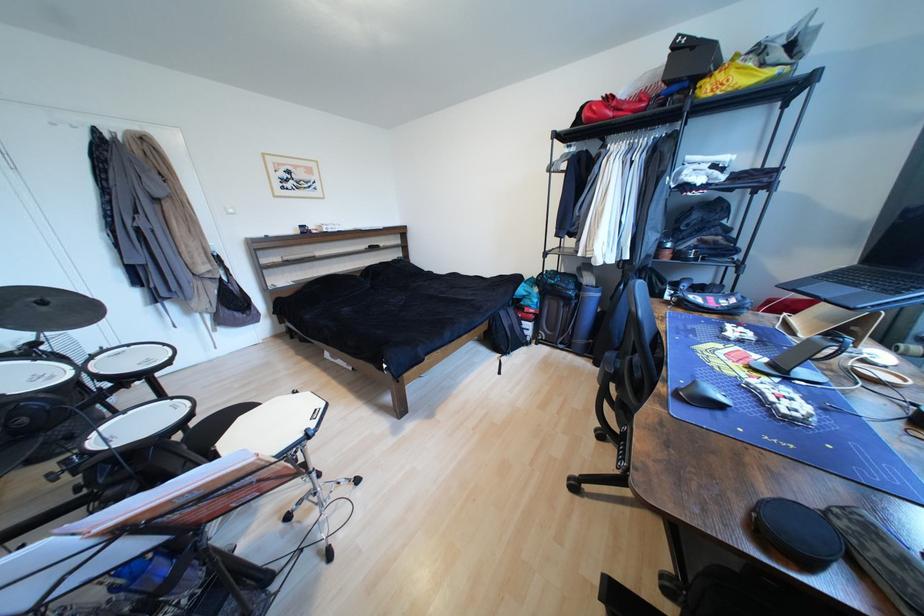
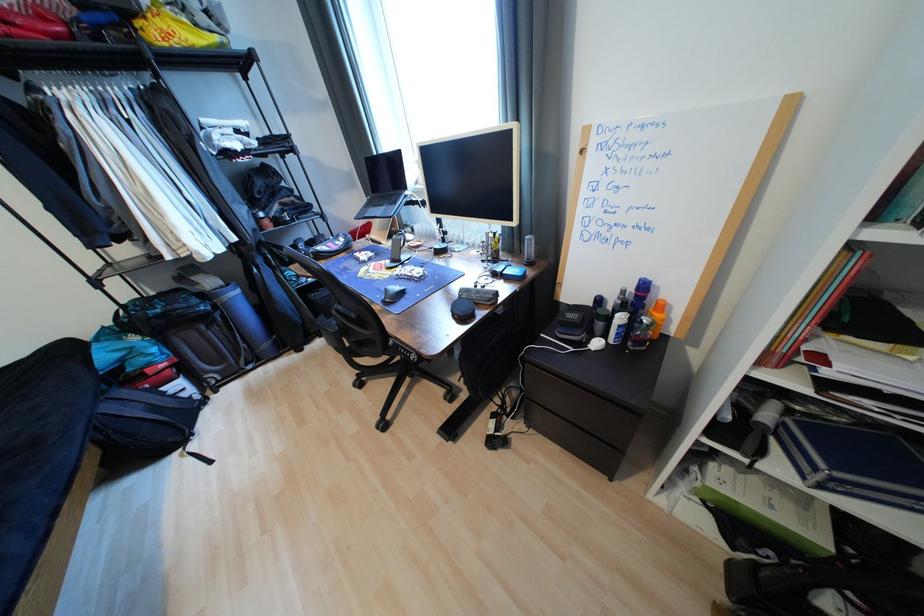
The point at (x=864, y=286) is marked in the first image. Where is the corresponding point in the second image?

(388, 207)